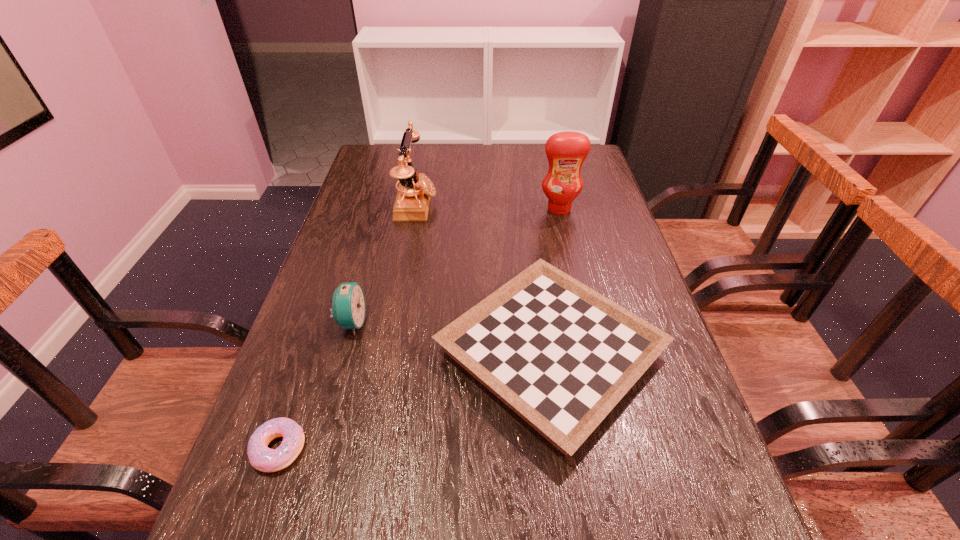
Image resolution: width=960 pixels, height=540 pixels. Identify the location of vacant area that lies between the third object from right to left and the fourth tallest object. tap(484, 278).

Identify the location of vacant area that lies between the alarm clock and the third object from left to right. Image resolution: width=960 pixels, height=540 pixels. (384, 263).

Identify the location of free spot between the third object from right to left and the condiment. (488, 207).

Where is `vacant region between the condiment and the alarm clock`? This screenshot has height=540, width=960. vacant region between the condiment and the alarm clock is located at coordinates 455,266.

Find the location of a particular element. Image resolution: width=960 pixels, height=540 pixels. vacant area between the condiment and the telephone is located at coordinates (488, 207).

This screenshot has width=960, height=540. I want to click on blank region between the condiment and the third tallest object, so click(x=455, y=266).

Locate which object is the third closest to the telephone. Please provide its 2D coordinates. Your answer should be formatted as a tuple, i.e. [(x, y)], where the tuple contains the x and y coordinates of a point satisfying the conditions above.

[(566, 151)]

Identify the location of object that stands as the third closest to the third tallest object. (412, 202).

Find the location of a particular element. The height and width of the screenshot is (540, 960). vacant area in the image that satisfies the following two spatial constraints: 1. on the label side of the condiment; 2. on the front-facing side of the third tallest object is located at coordinates (585, 322).